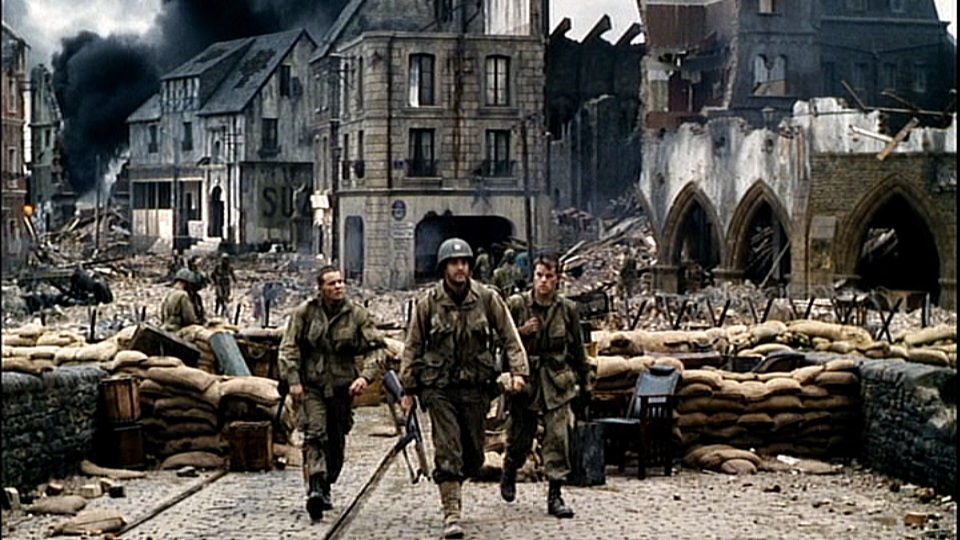
Locate an element on the screen. The width and height of the screenshot is (960, 540). window is located at coordinates (422, 144), (421, 64), (508, 70), (500, 146).